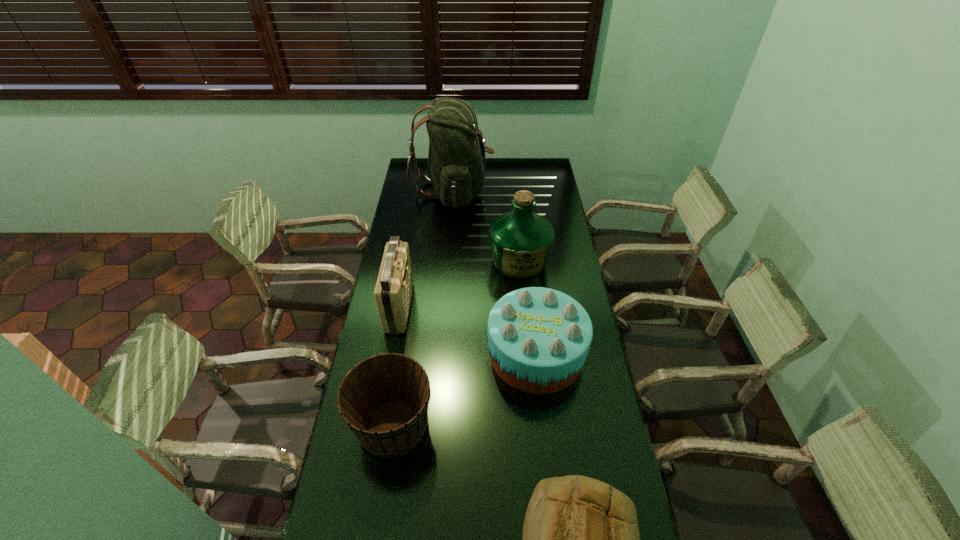
Find the location of a particular element. object that is the third closest to the fourth shortest object is located at coordinates (521, 240).

The image size is (960, 540). I want to click on vacant position in the image that satisfies the following two spatial constraints: 1. on the front-facing side of the radio receiver; 2. on the right side of the cake, so click(391, 354).

Locate an element on the screen. The image size is (960, 540). vacant point that satisfies the following two spatial constraints: 1. on the open flap of the farthest object; 2. on the left side of the cake is located at coordinates (440, 354).

This screenshot has height=540, width=960. Find the location of `vacant space that satisfies the following two spatial constraints: 1. on the label side of the liquor; 2. on the front-facing side of the fourth shortest object`. vacant space that satisfies the following two spatial constraints: 1. on the label side of the liquor; 2. on the front-facing side of the fourth shortest object is located at coordinates (523, 307).

At what (x,y) coordinates should I click in order to perform the action: click on vacant region that satisfies the following two spatial constraints: 1. on the front-facing side of the radio receiver; 2. on the right side of the cake. Please return your answer as a coordinate pair (x, y). Image resolution: width=960 pixels, height=540 pixels. Looking at the image, I should click on (391, 354).

In order to click on vacant region that satisfies the following two spatial constraints: 1. on the front-facing side of the radio receiver; 2. on the right side of the cake in this screenshot , I will do `click(391, 354)`.